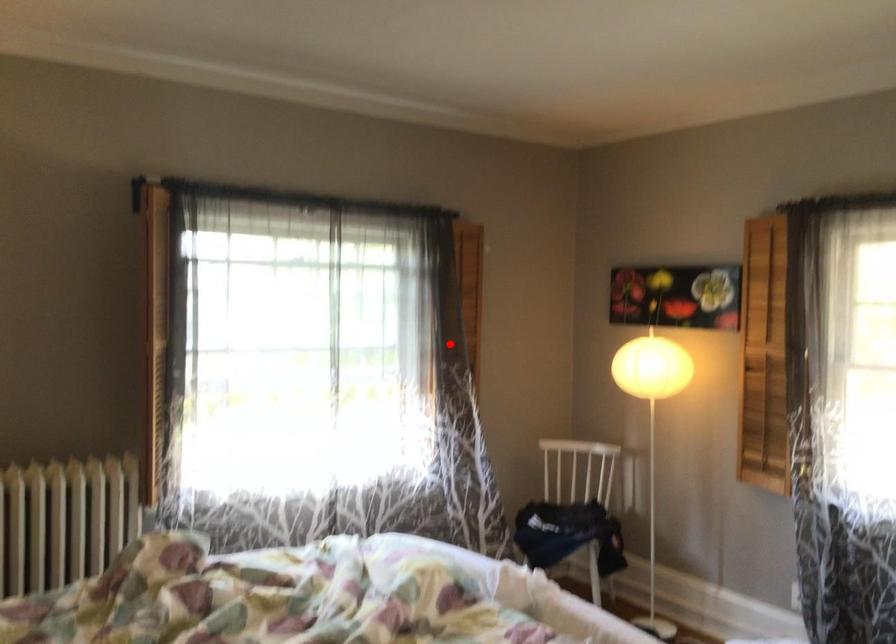
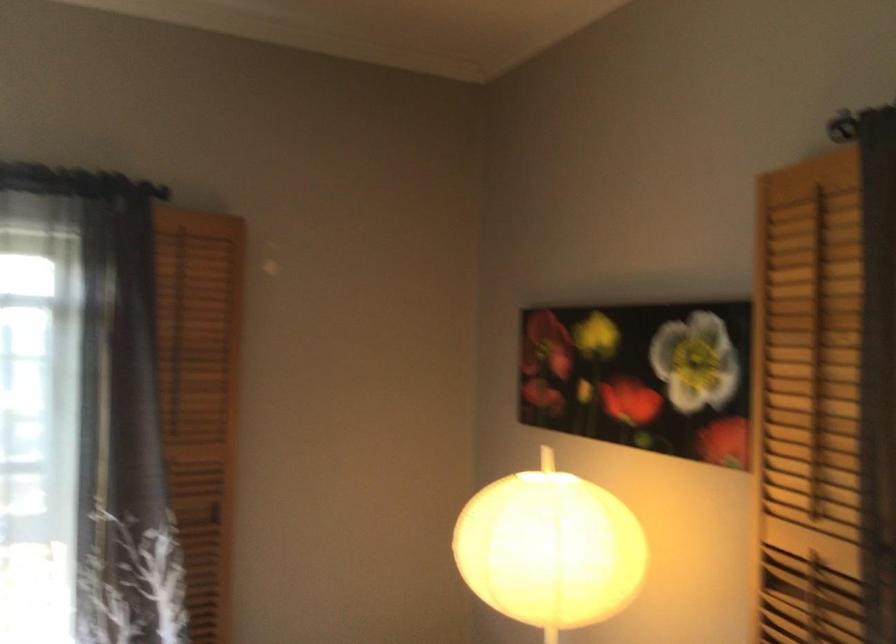
Question: I am providing you with two images of the same scene from different viewpoints. In image1, a red point is highlighted. Considering the same 3D point in image2, which of the following is correct?

Choices:
 (A) It is closer
 (B) It is farther

Answer: (A)